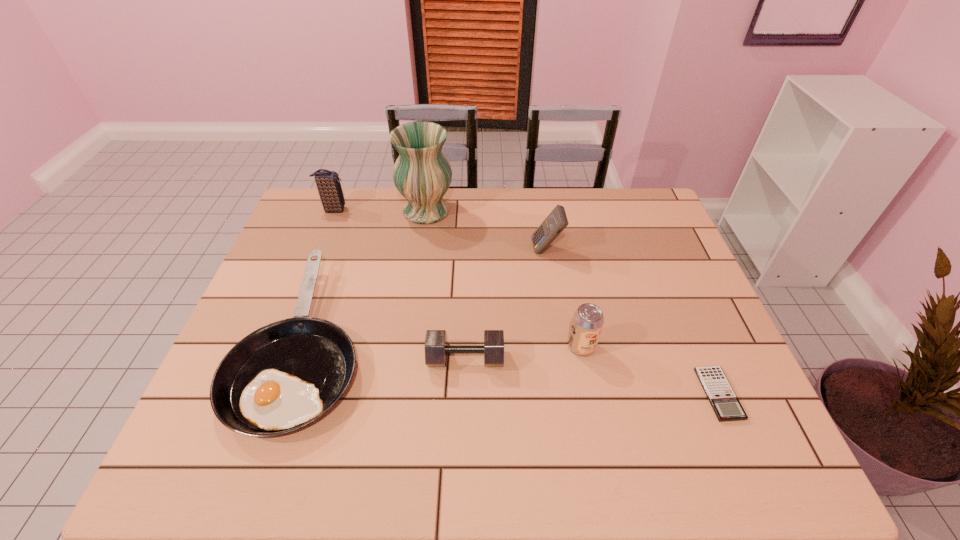
Locate an element on the screen. This screenshot has height=540, width=960. free space that is in between the farther calculator and the frying pan is located at coordinates (425, 295).

You are a GUI agent. You are given a task and a screenshot of the screen. Output one action in this format:
    pyautogui.click(x=<x>, y=<y>)
    Task: Click on the object that stands as the closest to the fourth tallest object
    The image size is (960, 540).
    Given the screenshot: What is the action you would take?
    pyautogui.click(x=436, y=349)

Identify the location of object that is the fifth closest to the fourth shortest object. (422, 174).

Find the location of a particular element. The height and width of the screenshot is (540, 960). vacant space that satisfies the following two spatial constraints: 1. on the back side of the fourth tallest object; 2. on the front-facing side of the farther calculator is located at coordinates (563, 249).

You are a GUI agent. You are given a task and a screenshot of the screen. Output one action in this format:
    pyautogui.click(x=<x>, y=<y>)
    Task: Click on the vacant point that satisfies the following two spatial constraints: 1. with the zip open on the rightmost object; 2. on the left side of the clutch bag
    This screenshot has height=540, width=960.
    Given the screenshot: What is the action you would take?
    pyautogui.click(x=262, y=394)

Image resolution: width=960 pixels, height=540 pixels. I want to click on blank space that satisfies the following two spatial constraints: 1. with the zip open on the clutch bag; 2. on the right side of the beer can, so click(280, 346).

What are the coordinates of `free spot that satisfies the following two spatial constraints: 1. with the zip open on the fourth shortest object; 2. on the right side of the clutch bag` in the screenshot? It's located at (280, 346).

The width and height of the screenshot is (960, 540). I want to click on vacant region that satisfies the following two spatial constraints: 1. on the back side of the shorter calculator; 2. on the front-facing side of the taller calculator, so click(x=657, y=249).

In order to click on free spot that satisfies the following two spatial constraints: 1. on the front side of the fourth tallest object; 2. on the left side of the vase in this screenshot , I will do `click(407, 346)`.